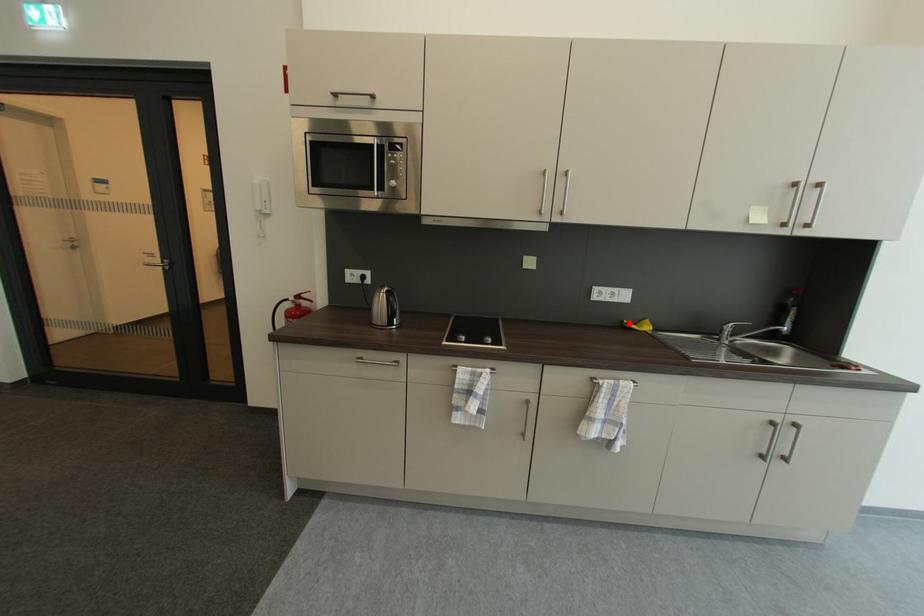
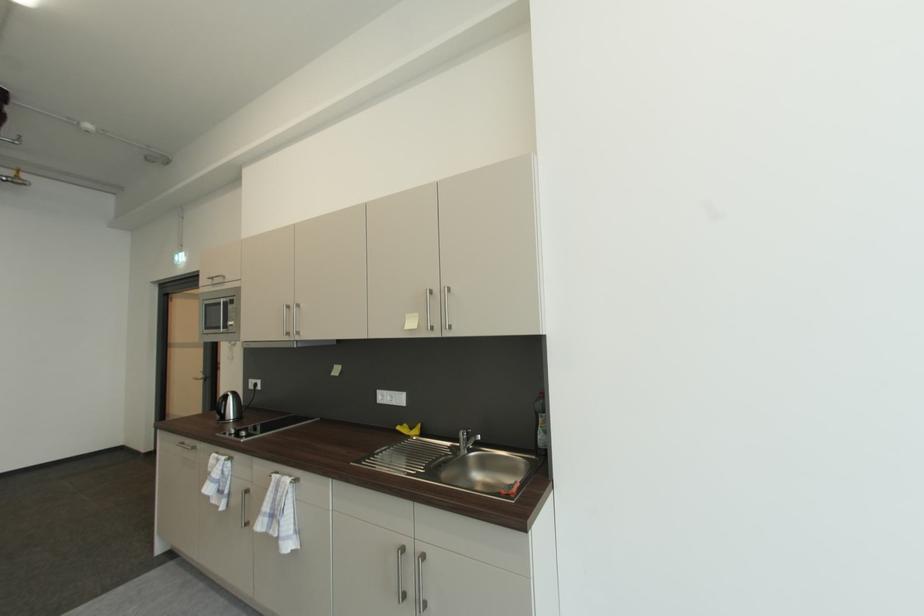
Where in the second image is the point corresponding to the highlighted location from the first image?

(408, 427)